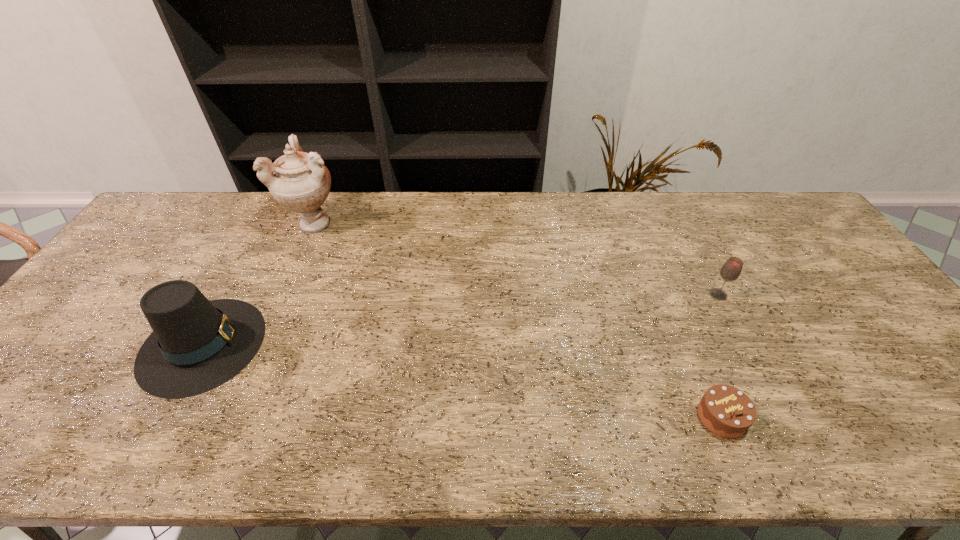
Find the location of `free space between the urn and the chocolate cake`. free space between the urn and the chocolate cake is located at coordinates (519, 320).

This screenshot has height=540, width=960. I want to click on free point between the glass drink container and the farthest object, so click(x=517, y=259).

What are the coordinates of `free space between the third tallest object and the chocolate cake` in the screenshot? It's located at (720, 356).

Identify the location of empty location between the third shortest object and the chocolate cake. (462, 380).

Locate an element on the screen. empty space between the glass drink container and the urn is located at coordinates (517, 259).

Locate an element on the screen. Image resolution: width=960 pixels, height=540 pixels. vacant area that lies between the glass drink container and the farthest object is located at coordinates (517, 259).

I want to click on unoccupied area between the third tallest object and the farthest object, so click(x=517, y=259).

You are a GUI agent. You are given a task and a screenshot of the screen. Output one action in this format:
    pyautogui.click(x=<x>, y=<y>)
    Task: Click on the unoccupied area between the third shortest object and the rightmost object
    
    Given the screenshot: What is the action you would take?
    pyautogui.click(x=460, y=320)

You are a GUI agent. You are given a task and a screenshot of the screen. Output one action in this format:
    pyautogui.click(x=<x>, y=<y>)
    Task: Click on the object that is the closest to the chocolate cake
    This screenshot has height=540, width=960.
    Given the screenshot: What is the action you would take?
    tap(731, 270)

Locate which object ranks third in proximity to the third tallest object. Please provide its 2D coordinates. Your answer should be formatted as a tuple, i.e. [(x, y)], where the tuple contains the x and y coordinates of a point satisfying the conditions above.

[(197, 345)]